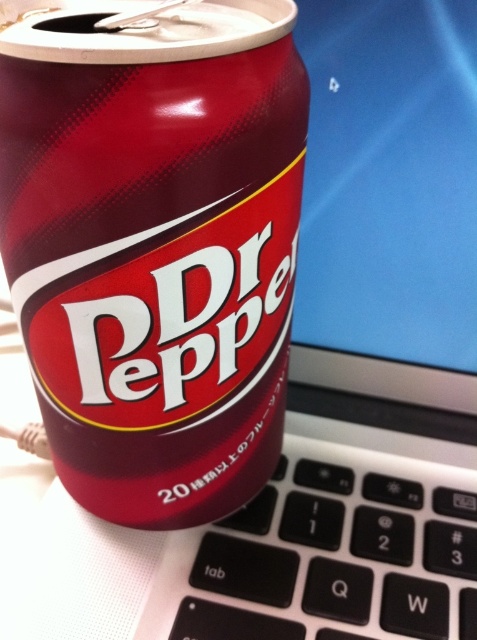
Can you confirm if glossy metallic can at center is wider than black plastic keyboard at lower center?

No, glossy metallic can at center is not wider than black plastic keyboard at lower center.

Does glossy metallic can at center have a lesser width compared to black plastic keyboard at lower center?

Indeed, glossy metallic can at center has a lesser width compared to black plastic keyboard at lower center.

What do you see at coordinates (154, 243) in the screenshot? This screenshot has height=640, width=477. I see `glossy metallic can at center` at bounding box center [154, 243].

Identify the location of glossy metallic can at center. This screenshot has height=640, width=477. (154, 243).